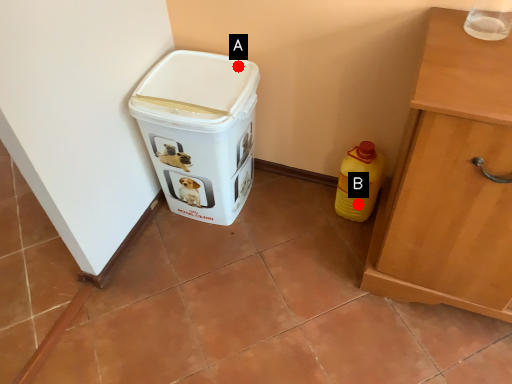
Question: Two points are circled on the image, labeled by A and B beside each circle. Which point is farther to the camera?

Choices:
 (A) A is further
 (B) B is further

Answer: (B)